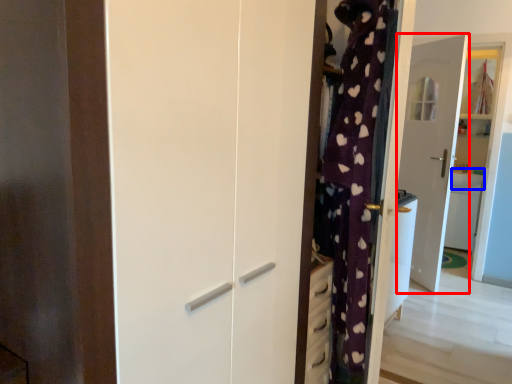
Question: Which object is closer to the camera taking this photo, door (highlighted by a red box) or counter top (highlighted by a blue box)?

Choices:
 (A) door
 (B) counter top

Answer: (A)